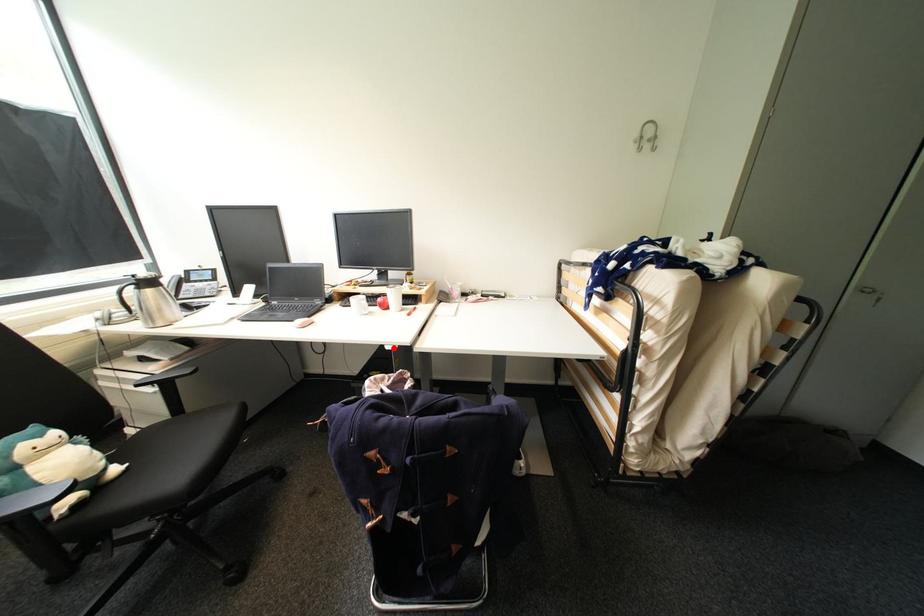
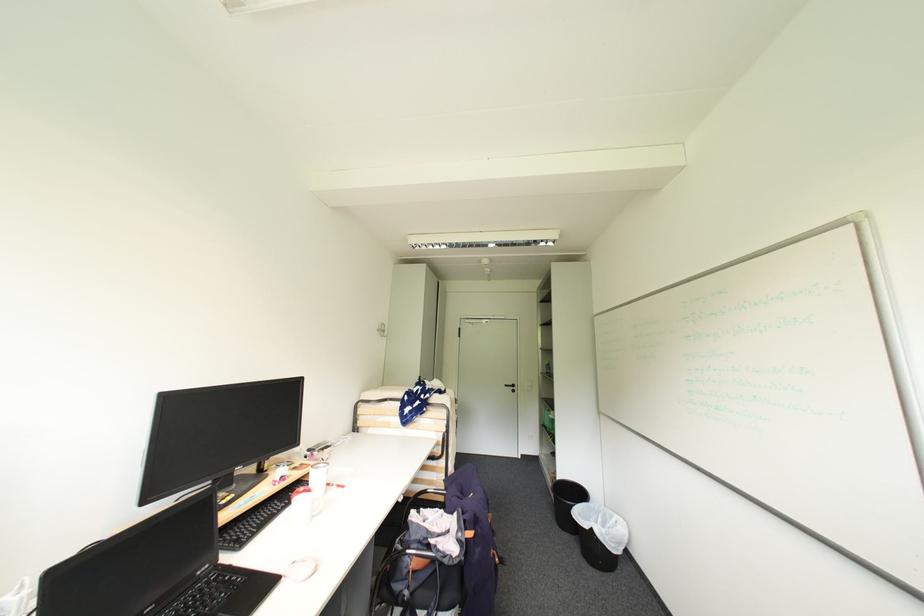
Find the pixel in the second image that matches the highlighted location in the first image.

(407, 501)